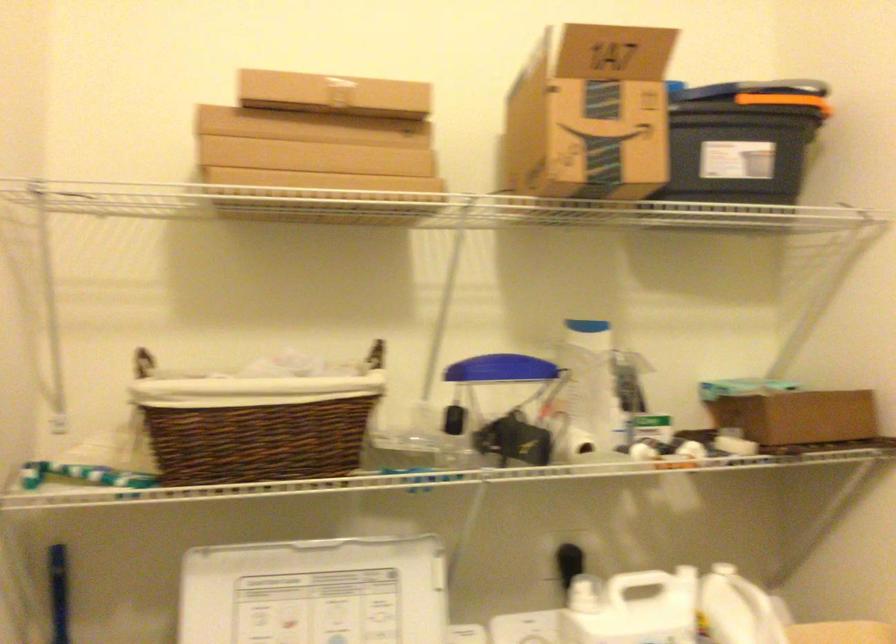
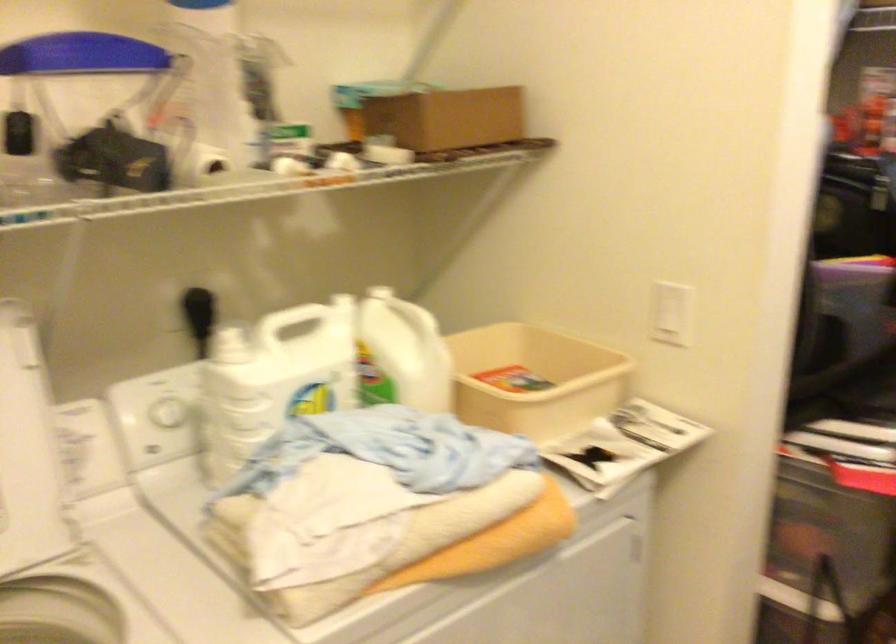
The point at (583, 450) is marked in the first image. Where is the corresponding point in the second image?

(211, 162)